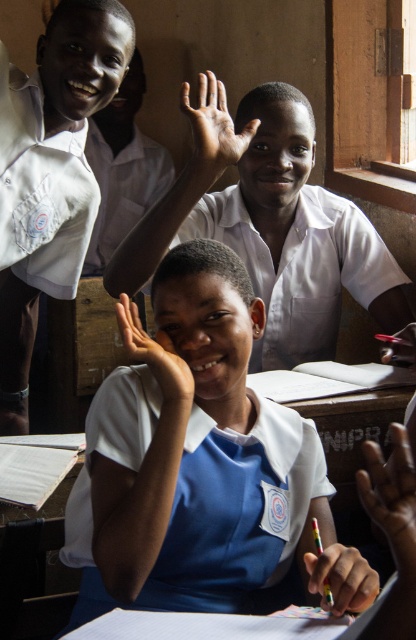
You are a photographer standing at the back of the classroom. You want to take a photo of both the white glossy uniform at upper center and the white smooth shirt at upper center. Can you see both of them clearly in the photo?

The white glossy uniform at upper center is in front of the white smooth shirt at upper center, so the white glossy uniform at upper center may block part of the white smooth shirt at upper center in the photo.

Based on the scene description, what are the coordinates of the white glossy uniform at upper center in the image?

The white glossy uniform at upper center is located at coordinates 0.420 in the x axis and 0.724 in the y axis.